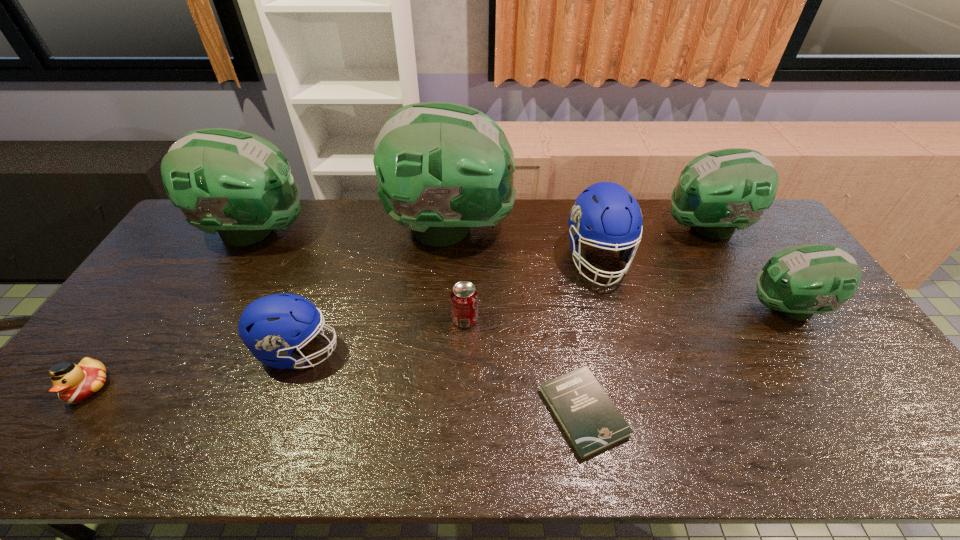
The height and width of the screenshot is (540, 960). I want to click on blank space that satisfies the following two spatial constraints: 1. on the visor of the book; 2. on the left side of the tallest football helmet, so click(437, 412).

Where is `free space in the image that satisfies the following two spatial constraints: 1. on the visor of the second green football helmet from left to right; 2. on the face of the duck`? The height and width of the screenshot is (540, 960). free space in the image that satisfies the following two spatial constraints: 1. on the visor of the second green football helmet from left to right; 2. on the face of the duck is located at coordinates (439, 387).